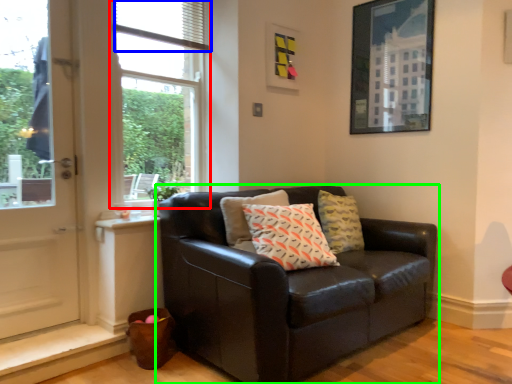
Question: Which object is positioned closest to window (highlighted by a red box)? Select from blind (highlighted by a blue box) and studio couch (highlighted by a green box).

Choices:
 (A) blind
 (B) studio couch

Answer: (A)